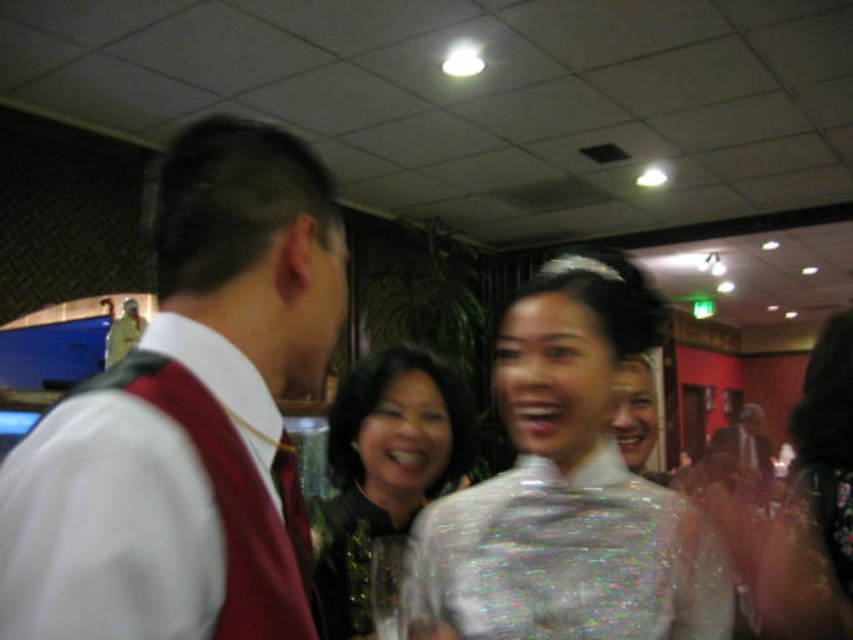
Question: Among these points, which one is nearest to the camera?

Choices:
 (A) (724, 426)
 (B) (527, 298)

Answer: (B)

Question: Is matte red vest at left in front of silky black dress at center?

Choices:
 (A) no
 (B) yes

Answer: (B)

Question: Which point is closer to the camera?

Choices:
 (A) (233, 141)
 (B) (590, 372)
 (C) (341, 474)

Answer: (A)

Question: Is matte red vest at left closer to camera compared to white sheer dress at center?

Choices:
 (A) no
 (B) yes

Answer: (B)

Question: Is matte red vest at left smaller than matte white face at center?

Choices:
 (A) yes
 (B) no

Answer: (A)

Question: Which of the following is the closest to the observer?

Choices:
 (A) silky black dress at center
 (B) matte white face at center
 (C) matte red vest at left

Answer: (C)